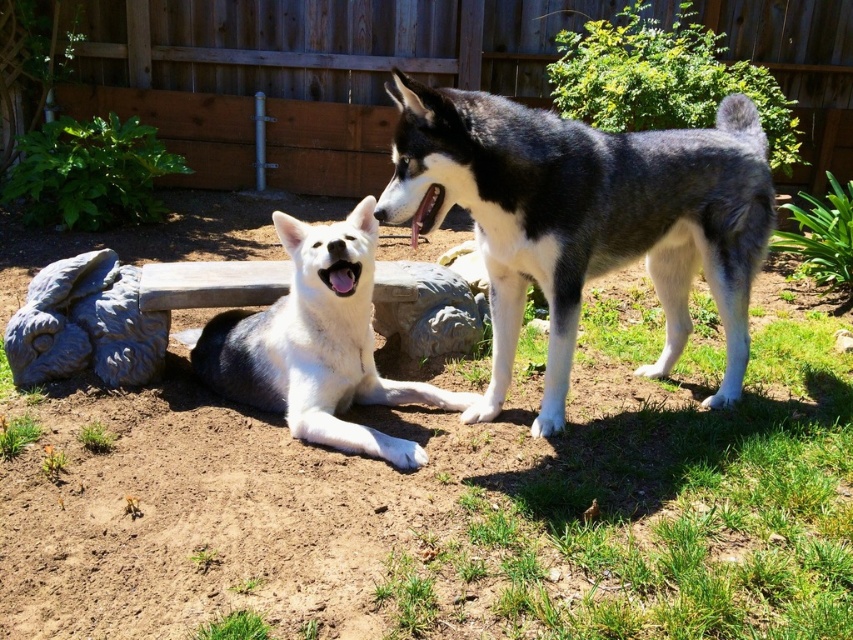
Question: Estimate the real-world distances between objects in this image. Which object is closer to the gray-black fur husky at center?

Choices:
 (A) white fur dog at center
 (B) gray stone statue at lower left

Answer: (A)

Question: Does gray-black fur husky at center have a smaller size compared to gray stone statue at lower left?

Choices:
 (A) yes
 (B) no

Answer: (B)

Question: Is gray-black fur husky at center positioned in front of gray stone statue at lower left?

Choices:
 (A) no
 (B) yes

Answer: (B)

Question: Among these points, which one is farthest from the camera?

Choices:
 (A) (123, 364)
 (B) (679, 152)

Answer: (A)

Question: Is gray-black fur husky at center to the left of white fur dog at center from the viewer's perspective?

Choices:
 (A) no
 (B) yes

Answer: (A)

Question: Which object is farther from the camera taking this photo?

Choices:
 (A) gray-black fur husky at center
 (B) white fur dog at center

Answer: (B)